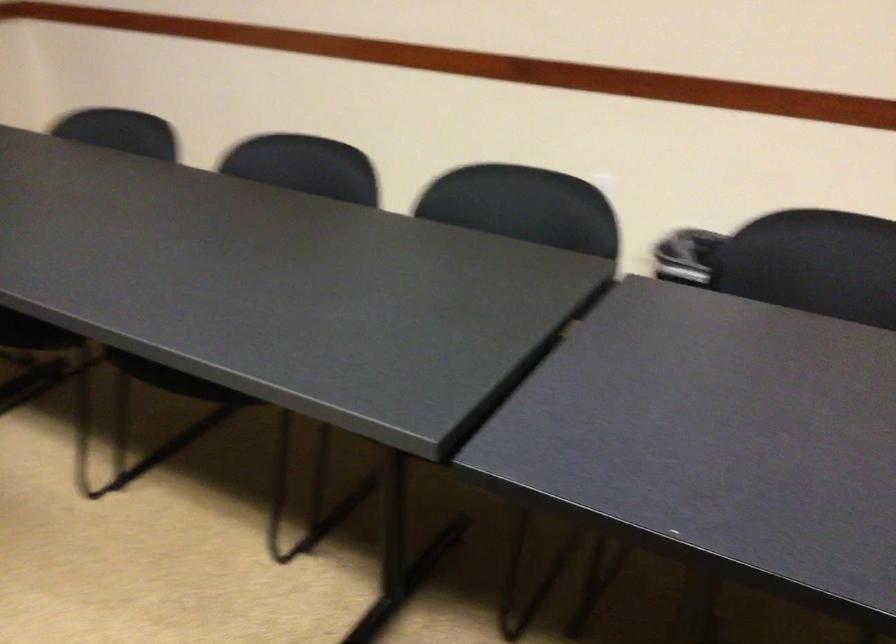
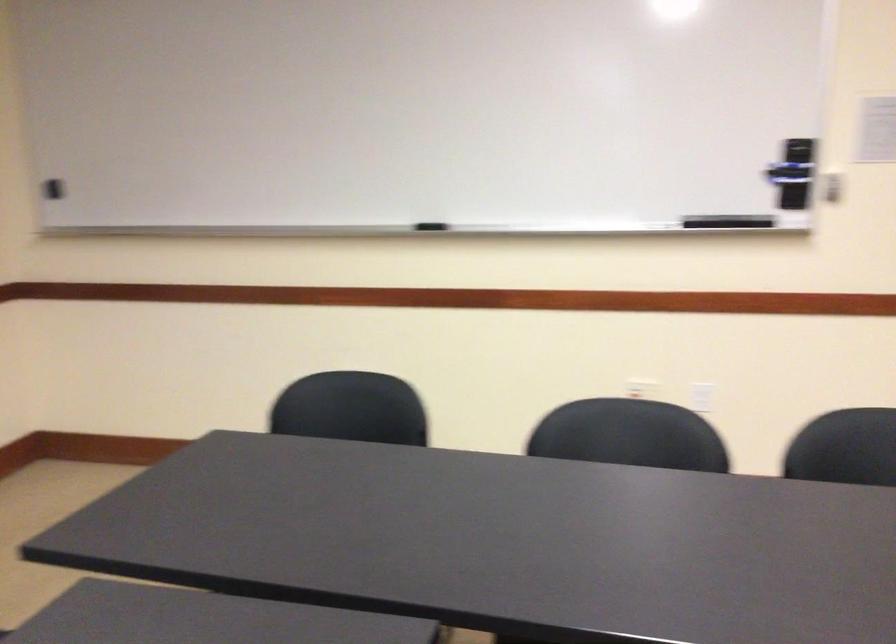
Question: The first image is from the beginning of the video and the second image is from the end. How did the camera likely rotate when shooting the video?

Choices:
 (A) Left
 (B) Right
 (C) Up
 (D) Down

Answer: (A)